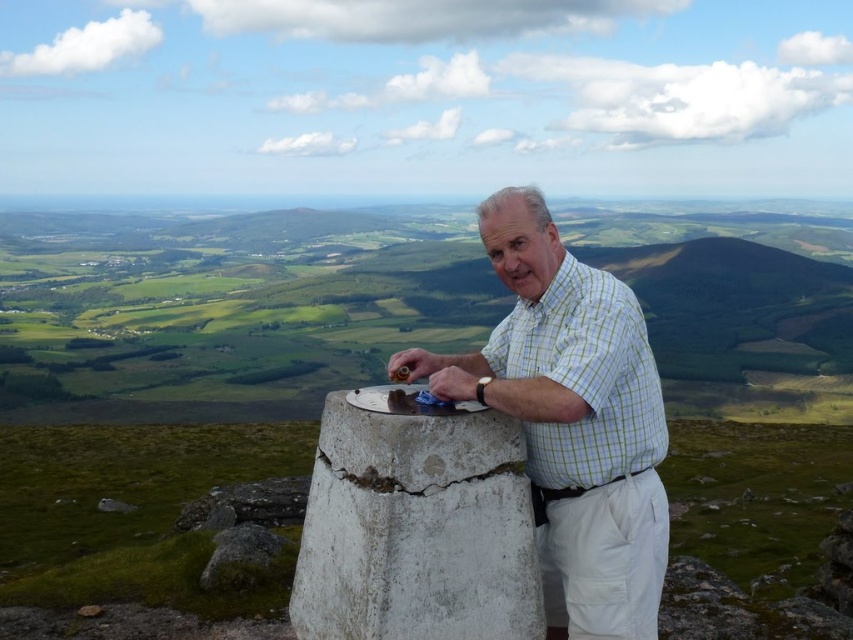
Who is shorter, white cracked cement at center or green checkered shirt at center?

white cracked cement at center is shorter.

Who is more distant from viewer, [397,465] or [602,355]?

The point [602,355] is behind.

At what (x,y) coordinates should I click in order to perform the action: click on white cracked cement at center. Please return your answer as a coordinate pair (x, y). The height and width of the screenshot is (640, 853). Looking at the image, I should click on (416, 524).

Between light green checkered shirt at center and white cracked cement at center, which one is positioned higher?

light green checkered shirt at center is higher up.

Which of these two, light green checkered shirt at center or white cracked cement at center, stands shorter?

white cracked cement at center

Identify the location of light green checkered shirt at center. The height and width of the screenshot is (640, 853). (572, 419).

Which is behind, point (515, 221) or point (621, 358)?

The point (515, 221) is behind.

Is light green checkered shirt at center smaller than green checkered shirt at center?

Incorrect, light green checkered shirt at center is not smaller in size than green checkered shirt at center.

The width and height of the screenshot is (853, 640). Identify the location of light green checkered shirt at center. (572, 419).

I want to click on light green checkered shirt at center, so click(572, 419).